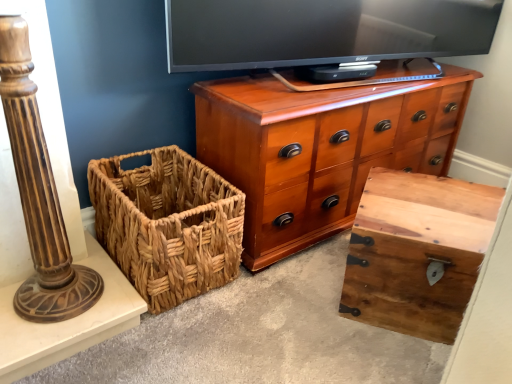
Question: Can you confirm if woven brown basket at lower left is thinner than rustic wood trunk at center?

Choices:
 (A) no
 (B) yes

Answer: (A)

Question: Considering the relative positions of woven brown basket at lower left and rustic wood trunk at center in the image provided, is woven brown basket at lower left to the right of rustic wood trunk at center from the viewer's perspective?

Choices:
 (A) no
 (B) yes

Answer: (A)

Question: From the image's perspective, would you say woven brown basket at lower left is shown under rustic wood trunk at center?

Choices:
 (A) no
 (B) yes

Answer: (A)

Question: Is woven brown basket at lower left positioned behind rustic wood trunk at center?

Choices:
 (A) yes
 (B) no

Answer: (A)

Question: From a real-world perspective, does woven brown basket at lower left stand above rustic wood trunk at center?

Choices:
 (A) no
 (B) yes

Answer: (B)

Question: Is woven brown basket at lower left looking in the opposite direction of rustic wood trunk at center?

Choices:
 (A) no
 (B) yes

Answer: (A)

Question: Is rustic wood trunk at center outside of woven brown basket at lower left?

Choices:
 (A) no
 (B) yes

Answer: (B)

Question: Is rustic wood trunk at center thinner than woven brown basket at lower left?

Choices:
 (A) no
 (B) yes

Answer: (B)

Question: Can you confirm if rustic wood trunk at center is shorter than woven brown basket at lower left?

Choices:
 (A) no
 (B) yes

Answer: (B)

Question: Is the position of rustic wood trunk at center more distant than that of woven brown basket at lower left?

Choices:
 (A) yes
 (B) no

Answer: (B)

Question: Is rustic wood trunk at center positioned with its back to woven brown basket at lower left?

Choices:
 (A) no
 (B) yes

Answer: (A)

Question: Is rustic wood trunk at center at the right side of woven brown basket at lower left?

Choices:
 (A) yes
 (B) no

Answer: (A)

Question: Does brown polished wood column at left have a smaller size compared to rustic wood trunk at center?

Choices:
 (A) no
 (B) yes

Answer: (B)